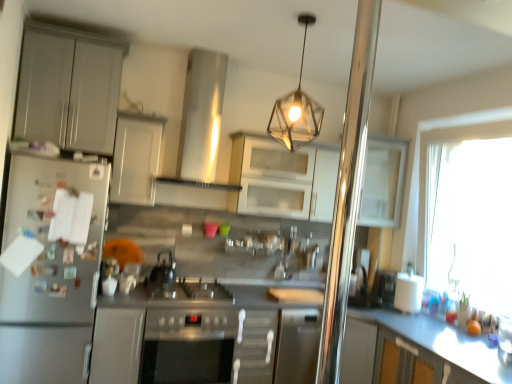
Question: From the image's perspective, is satin silver refrigerator at left located above or below shiny metallic kettle at center?

Choices:
 (A) above
 (B) below

Answer: (B)

Question: In terms of width, does satin silver refrigerator at left look wider or thinner when compared to shiny metallic kettle at center?

Choices:
 (A) wide
 (B) thin

Answer: (A)

Question: Which of these objects is positioned farthest from the transparent glass window at right?

Choices:
 (A) satin silver refrigerator at left
 (B) white matte cabinet at upper center, which is the 3th cabinetry from left to right
 (C) metallic hexagonal light fixture at upper center
 (D) shiny metallic kettle at center
 (E) white glossy cabinet at center, arranged as the fourth cabinetry when viewed from the left

Answer: (A)

Question: Which object is the closest to the metallic hexagonal light fixture at upper center?

Choices:
 (A) transparent glass window at right
 (B) satin silver exhaust hood at upper center
 (C) matte gray cabinet at lower center, the 4th cabinetry from the right
 (D) white glossy cabinet at upper right, the fifth cabinetry in the left-to-right sequence
 (E) white glossy cabinet at center, arranged as the fourth cabinetry when viewed from the left

Answer: (E)